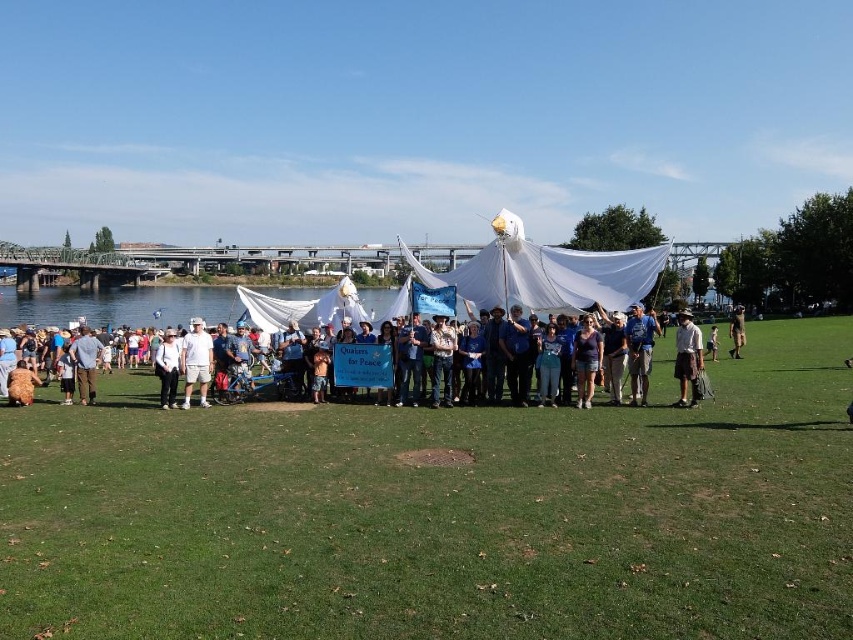
Does point (695, 387) come closer to viewer compared to point (209, 365)?

Yes, point (695, 387) is closer to viewer.

Does khaki fabric shorts at center have a larger size compared to white cotton shorts at center?

Yes.

Between point (689, 397) and point (202, 358), which one is positioned behind?

Point (202, 358)

The height and width of the screenshot is (640, 853). In order to click on khaki fabric shorts at center in this screenshot , I will do `click(688, 358)`.

Does green grass at center have a larger size compared to brown leather jacket at center?

Yes.

Where is `green grass at center`? The width and height of the screenshot is (853, 640). green grass at center is located at coordinates (440, 513).

Is green grass at center to the right of khaki fabric shorts at center from the viewer's perspective?

No, green grass at center is not to the right of khaki fabric shorts at center.

Which is below, green grass at center or khaki fabric shorts at center?

Positioned lower is green grass at center.

Between point (93, 417) and point (697, 326), which one is positioned in front?

Point (93, 417) is in front.

The image size is (853, 640). I want to click on green grass at center, so click(440, 513).